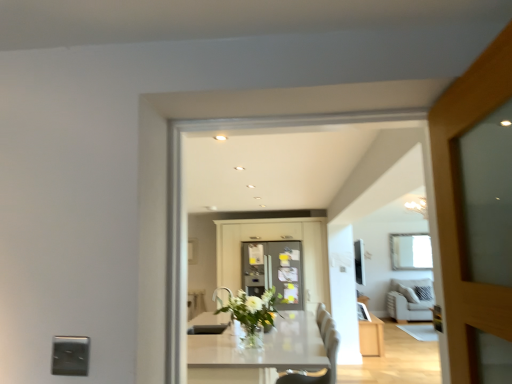
Question: Is white fabric couch at right to the left or to the right of white glass vase at center in the image?

Choices:
 (A) right
 (B) left

Answer: (A)

Question: Is white fabric couch at right wider or thinner than white glass vase at center?

Choices:
 (A) thin
 (B) wide

Answer: (A)

Question: Considering the real-world distances, which object is farthest from the metallic refrigerator at center?

Choices:
 (A) white glossy table at center
 (B) white leather chair at center
 (C) matte gray refrigerator at center, the first cabinetry positioned from the left
 (D) white fabric couch at right
 (E) matte white cabinet at lower right, the first cabinetry in the right-to-left sequence

Answer: (D)

Question: Which object is the farthest from the metallic refrigerator at center?

Choices:
 (A) white glass vase at center
 (B) white glossy table at center
 (C) matte white cabinet at lower right, which appears as the 2th cabinetry when viewed from the left
 (D) white fabric couch at right
 (E) satin silver outlet at lower left

Answer: (E)